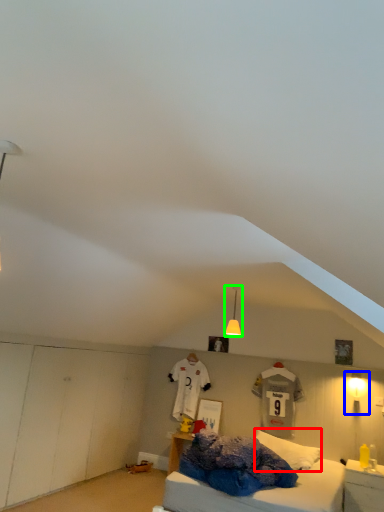
Question: Which object is the farthest from pillow (highlighted by a red box)? Choose among these: light fixture (highlighted by a blue box) or light fixture (highlighted by a green box).

Choices:
 (A) light fixture
 (B) light fixture

Answer: (A)